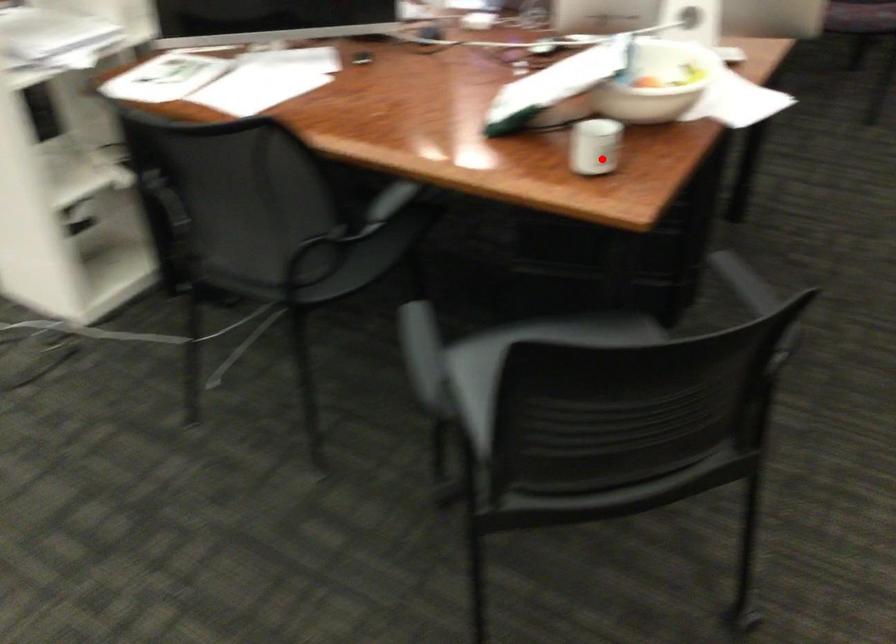
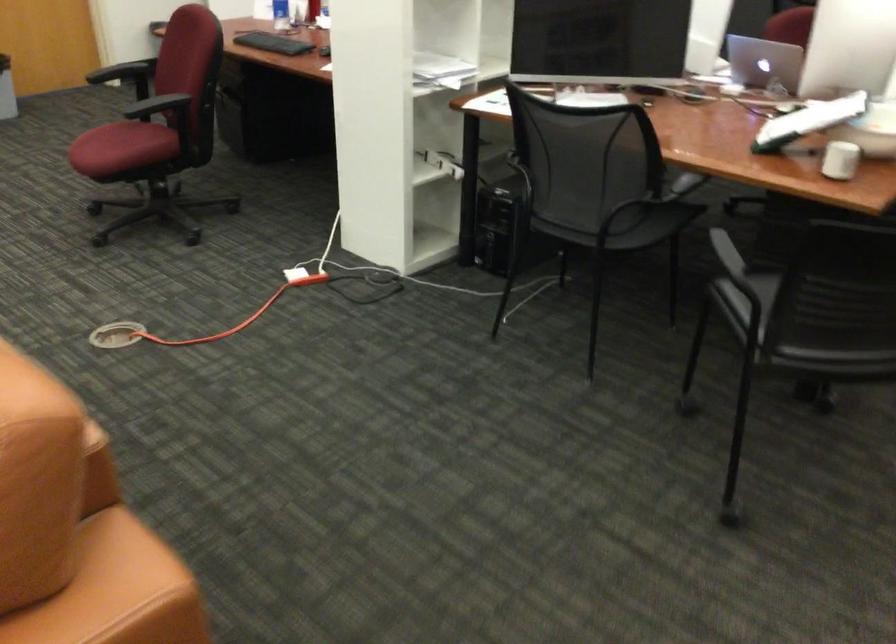
Question: I am providing you with two images of the same scene from different viewpoints. In image1, a red point is highlighted. Considering the same 3D point in image2, which of the following is correct?

Choices:
 (A) It is closer
 (B) It is farther

Answer: (B)